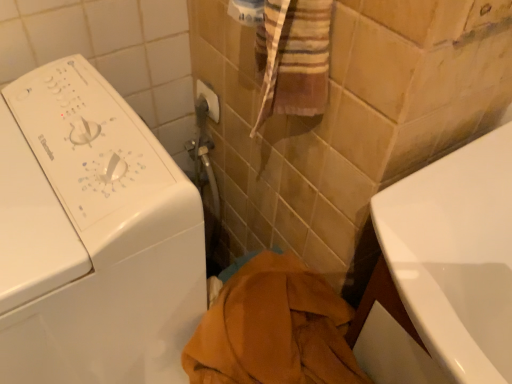
Question: In terms of height, does white glossy bathtub at lower right look taller or shorter compared to white glossy washing machine at left?

Choices:
 (A) tall
 (B) short

Answer: (B)

Question: Relative to white glossy washing machine at left, is white glossy bathtub at lower right in front or behind?

Choices:
 (A) behind
 (B) front

Answer: (A)

Question: Which is farther from the white glossy bathtub at lower right?

Choices:
 (A) brown cotton towel at center
 (B) white plastic towel bar at upper center
 (C) white glossy washing machine at left

Answer: (B)

Question: Which of these objects is positioned farthest from the white glossy bathtub at lower right?

Choices:
 (A) white glossy washing machine at left
 (B) white plastic towel bar at upper center
 (C) brown cotton towel at center

Answer: (B)